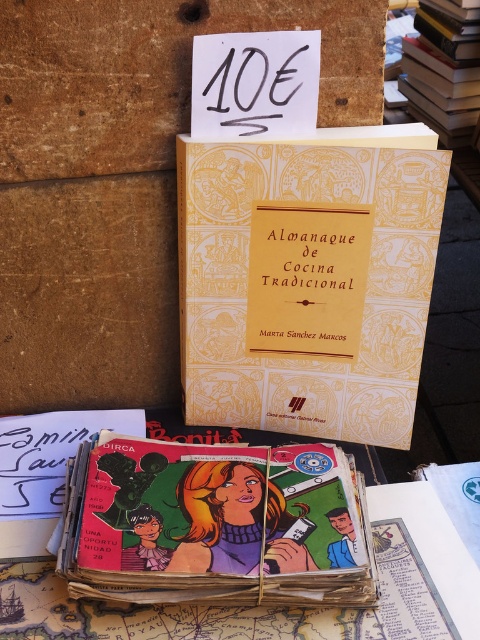
Question: Which point is farther from the camera taking this photo?

Choices:
 (A) (421, 109)
 (B) (229, 330)

Answer: (A)

Question: Can you confirm if colorful glossy comic book at lower center is thinner than yellow paper-covered book at upper right?

Choices:
 (A) no
 (B) yes

Answer: (A)

Question: Which object appears farthest from the camera in this image?

Choices:
 (A) colorful glossy comic book at lower center
 (B) gold-patterned book at center
 (C) yellow paper-covered book at upper right

Answer: (C)

Question: Can you confirm if gold-patterned book at center is positioned below yellow paper-covered book at upper right?

Choices:
 (A) yes
 (B) no

Answer: (A)

Question: Which object appears closest to the camera in this image?

Choices:
 (A) colorful glossy comic book at lower center
 (B) gold-patterned book at center

Answer: (A)

Question: Is gold-patterned book at center above colorful glossy comic book at lower center?

Choices:
 (A) no
 (B) yes

Answer: (B)